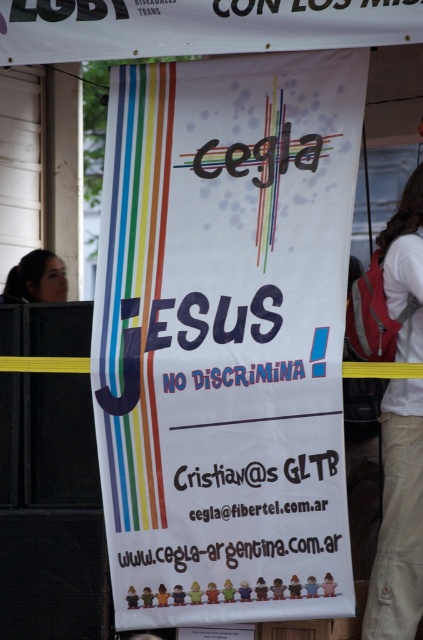
You are attending an event and notice the white paper banner at center and the white cotton shirt at right. Which object is taller?

The white paper banner at center is taller than the white cotton shirt at right.

You are standing in front of the banner and want to touch both the white paper banner at center and the white cotton shirt at right. Which object is closer to you?

The white paper banner at center is closer to you since it is only 36.07 inches away from the white cotton shirt at right, meaning the banner is nearer than the shirt.

You are standing in front of the large vertical banner and want to touch both the white paper banner at center and the white paper banner at upper center. Which one can you reach first without moving your position?

You can reach the white paper banner at center first because it is closer to you than the white paper banner at upper center.